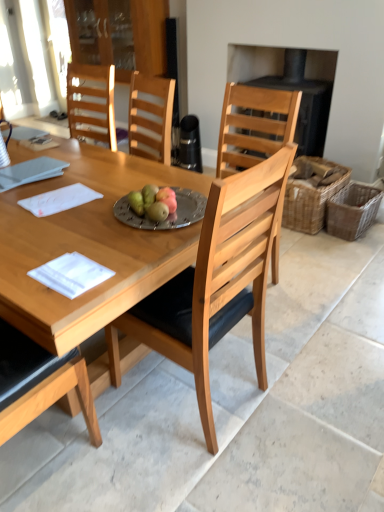
Identify the location of spots to the right of light wood chair at center. (296, 401).